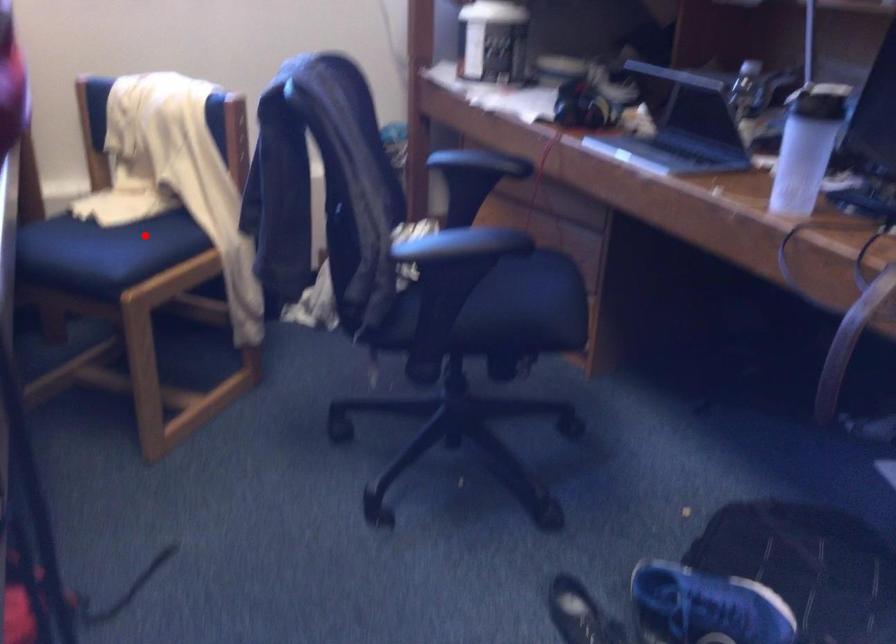
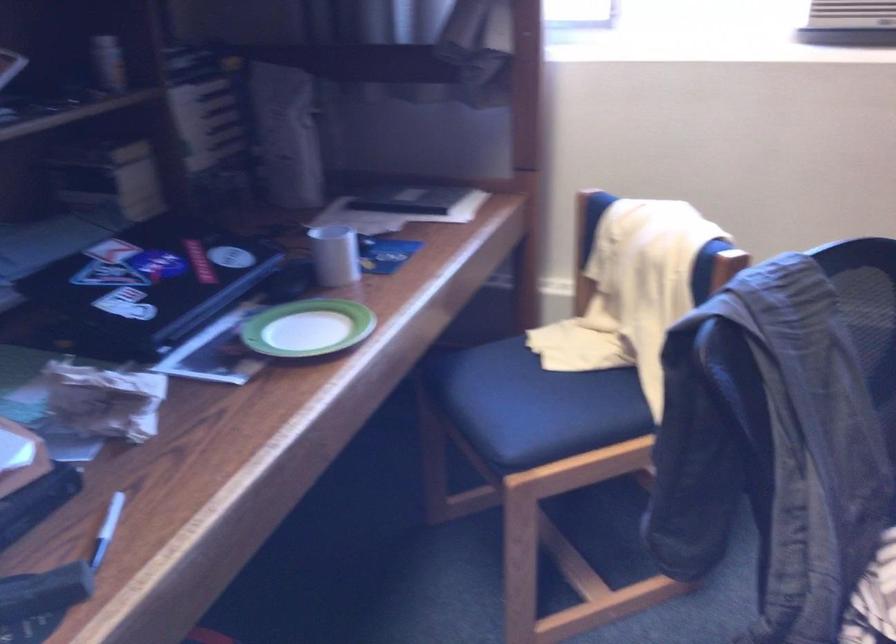
Question: I am providing you with two images of the same scene from different viewpoints. Image1 has a red point marked. In image2, the corresponding 3D location appears at what relative position? Reply with the corresponding letter.

Choices:
 (A) Closer
 (B) Farther

Answer: (A)